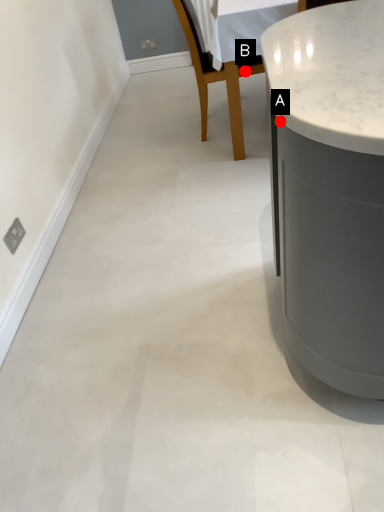
Question: Two points are circled on the image, labeled by A and B beside each circle. Which point is farther from the camera taking this photo?

Choices:
 (A) A is further
 (B) B is further

Answer: (B)